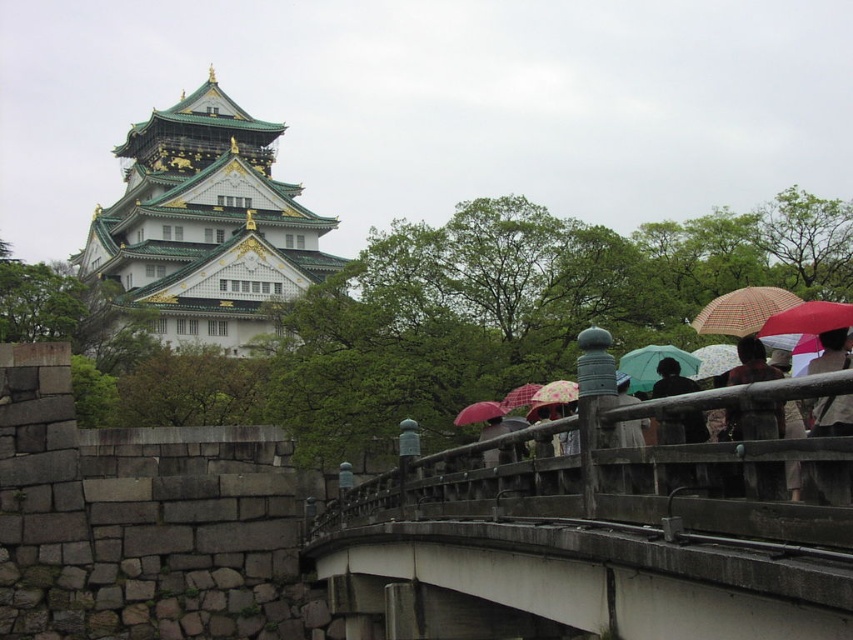
You are a tourist visiting the castle and want to take a photo of both the floral fabric umbrella at upper right and the translucent plastic umbrella at center. Which umbrella should you focus on first to ensure both are in the frame?

You should focus on the translucent plastic umbrella at center first because it is larger than the floral fabric umbrella at upper right, ensuring both fit within the camera frame.

You are a visitor at the castle and want to take a photo of the castle with both the matte red umbrella at center and the translucent plastic umbrella at center in the background. Which umbrella should you position closer to the camera to ensure both are visible in the frame?

To ensure both the matte red umbrella at center and the translucent plastic umbrella at center are visible in the frame, position the matte red umbrella at center closer to the camera since it is already in front of the translucent plastic umbrella at center. This way, both umbrellas will be in the photo without one blocking the other.

You are a visitor at the castle and want to know if you can fit both your 1.2 meter wide backpack and a friend between the matte red umbrella at center and the translucent plastic umbrella at center. Can you? Please explain.

The distance between the matte red umbrella at center and the translucent plastic umbrella at center is 1.44 meters. Since your backpack is 1.2 meters wide, there would be only 0.24 meters remaining for your friend. This is insufficient space for a person to comfortably stand or move, so it would not be advisable to try to fit both the backpack and a friend between them.